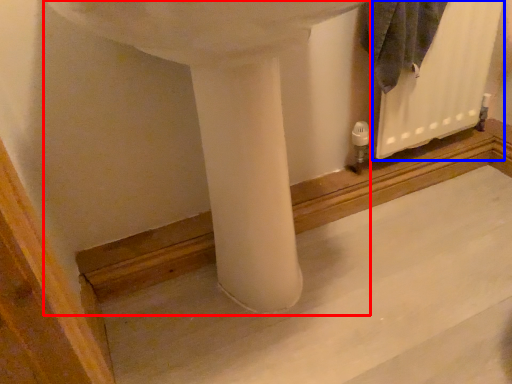
Question: Which of the following is the closest to the observer, sink (highlighted by a red box) or radiator (highlighted by a blue box)?

Choices:
 (A) sink
 (B) radiator

Answer: (A)